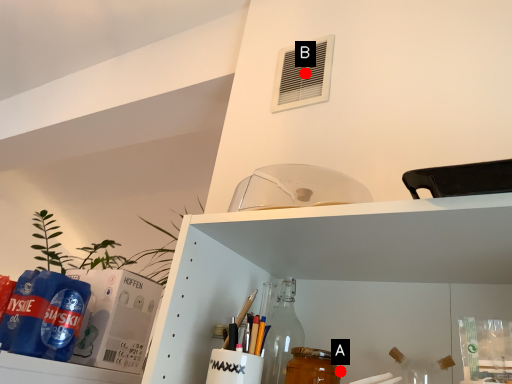
Question: Two points are circled on the image, labeled by A and B beside each circle. Which point appears farthest from the camera in this image?

Choices:
 (A) A is further
 (B) B is further

Answer: (B)